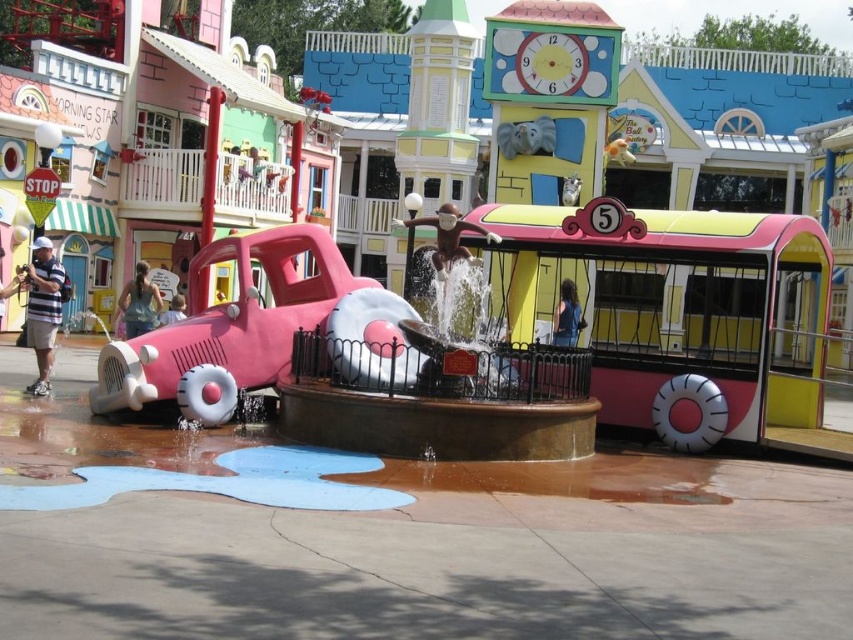
Does point (164, 376) come behind point (563, 310)?

No, (164, 376) is closer to viewer.

Where is `pink rubber car at center`? The image size is (853, 640). pink rubber car at center is located at coordinates (229, 328).

Does point (38, 237) come closer to viewer compared to point (173, 300)?

Yes, it is.

Is striped shirt at left taller than light blue shirt at center?

Correct, striped shirt at left is much taller as light blue shirt at center.

Is point (44, 326) farther from viewer compared to point (167, 317)?

No.

Locate an element on the screen. The width and height of the screenshot is (853, 640). striped shirt at left is located at coordinates (42, 308).

How far apart are striped shirt at left and denim jacket at lower left?

They are 10.31 meters apart.

Is point (36, 358) farther from camera compared to point (134, 332)?

No.

Does point (48, 390) come closer to viewer compared to point (149, 307)?

Yes, point (48, 390) is closer to viewer.

You are a GUI agent. You are given a task and a screenshot of the screen. Output one action in this format:
    pyautogui.click(x=<x>, y=<y>)
    Task: Click on the striped shirt at left
    
    Given the screenshot: What is the action you would take?
    pyautogui.click(x=42, y=308)